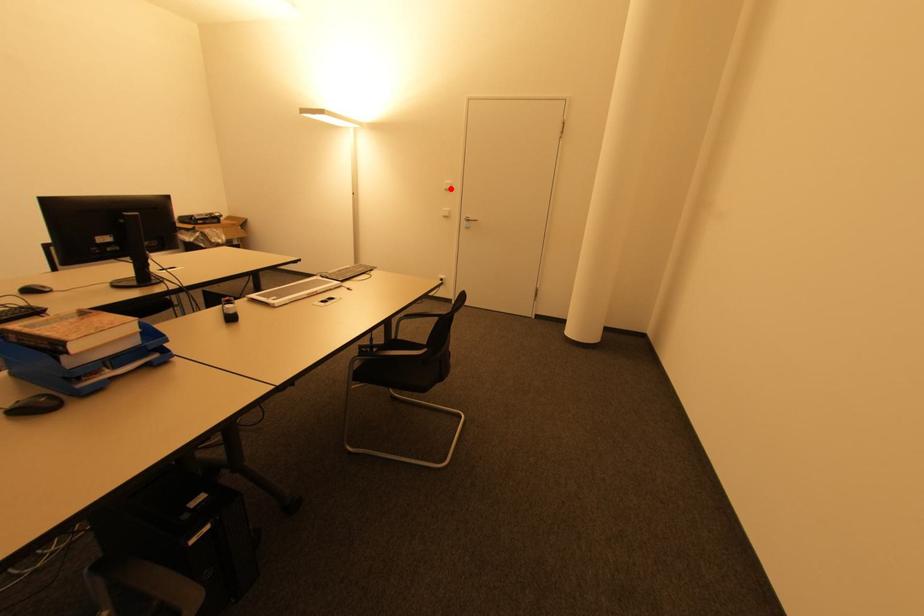
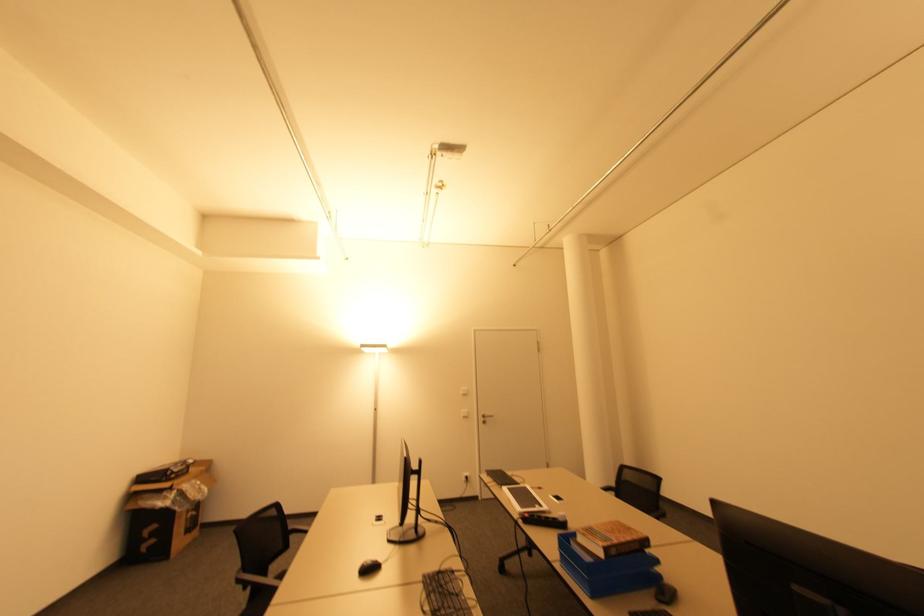
Where in the second image is the point corresponding to the highlighted location from the first image?

(468, 392)